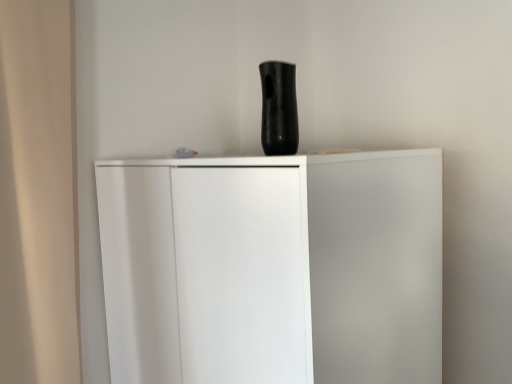
Question: Visually, is black glossy vase at upper center positioned to the left or to the right of white matte cupboard at center?

Choices:
 (A) left
 (B) right

Answer: (B)

Question: Relative to white matte cupboard at center, is black glossy vase at upper center in front or behind?

Choices:
 (A) behind
 (B) front

Answer: (A)

Question: Considering the positions of black glossy vase at upper center and white matte cupboard at center in the image, is black glossy vase at upper center bigger or smaller than white matte cupboard at center?

Choices:
 (A) small
 (B) big

Answer: (A)

Question: From a real-world perspective, is white matte cupboard at center positioned above or below black glossy vase at upper center?

Choices:
 (A) above
 (B) below

Answer: (B)

Question: In the image, is white matte cupboard at center positioned in front of or behind black glossy vase at upper center?

Choices:
 (A) behind
 (B) front

Answer: (B)

Question: Is white matte cupboard at center wider or thinner than black glossy vase at upper center?

Choices:
 (A) thin
 (B) wide

Answer: (B)

Question: Does point (262, 319) appear closer or farther from the camera than point (287, 97)?

Choices:
 (A) closer
 (B) farther

Answer: (A)